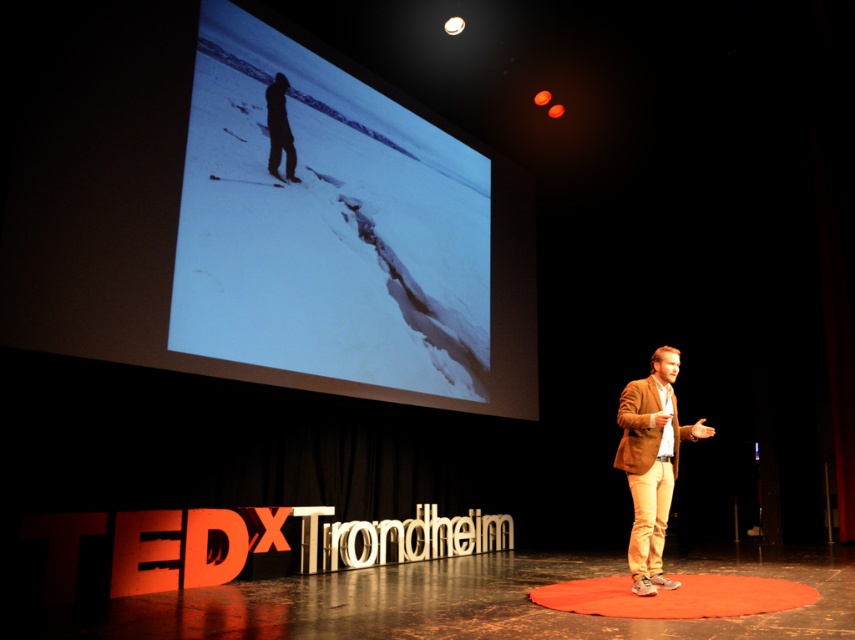
Does point (667, 476) lie in front of point (538, 589)?

Yes, it is in front of point (538, 589).

Between brown leather jacket at center and rubberized orange circle at center, which one has less height?

rubberized orange circle at center

The image size is (855, 640). What are the coordinates of `brown leather jacket at center` in the screenshot? It's located at (652, 464).

Is point (411, 284) less distant than point (712, 588)?

No, it is not.

Can you confirm if silvery metallic screen at upper center is bigger than rubberized orange circle at center?

Yes, silvery metallic screen at upper center is bigger than rubberized orange circle at center.

Locate an element on the screen. silvery metallic screen at upper center is located at coordinates (326, 225).

Is point (314, 273) more distant than point (273, 163)?

Yes.

Who is taller, silvery metallic screen at upper center or dark silhouette figure at upper center?

silvery metallic screen at upper center is taller.

Does point (258, 342) come farther from viewer compared to point (273, 84)?

That is False.

Find the location of a particular element. The height and width of the screenshot is (640, 855). silvery metallic screen at upper center is located at coordinates (326, 225).